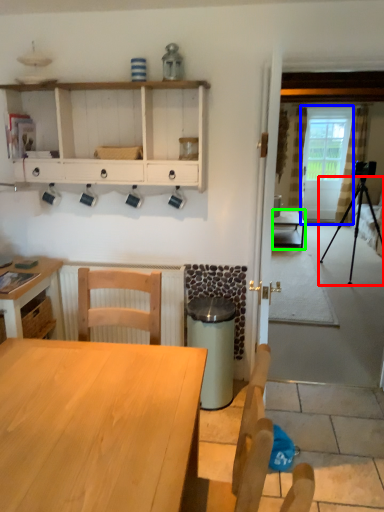
Question: Estimate the real-world distances between objects in this image. Which object is closer to tripod (highlighted by a red box), screen door (highlighted by a blue box) or table (highlighted by a green box)?

Choices:
 (A) screen door
 (B) table

Answer: (A)